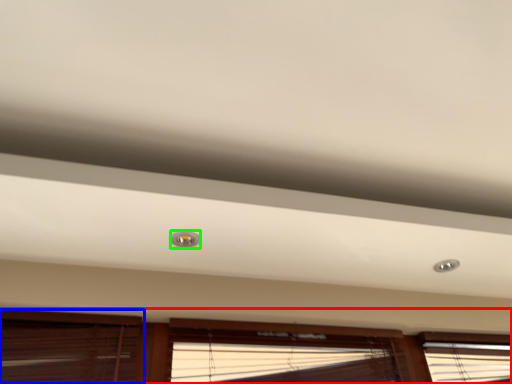
Question: Considering the real-world distances, which object is farthest from window (highlighted by a red box)? window (highlighted by a blue box) or droplight (highlighted by a green box)?

Choices:
 (A) window
 (B) droplight

Answer: (B)